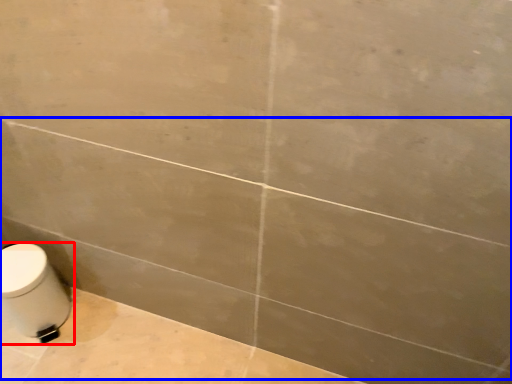
Question: Which object is closer to the camera taking this photo, toilet (highlighted by a red box) or bath (highlighted by a blue box)?

Choices:
 (A) toilet
 (B) bath

Answer: (B)